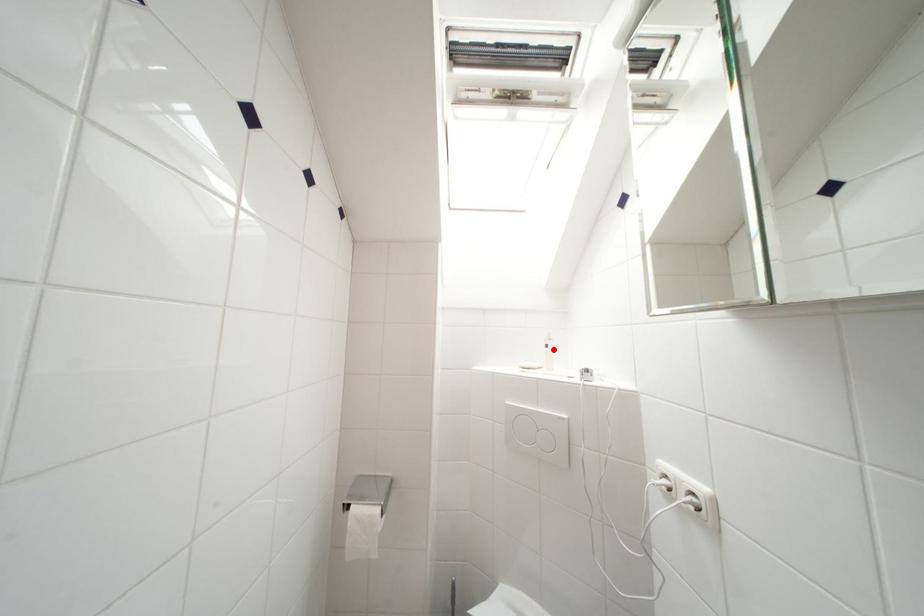
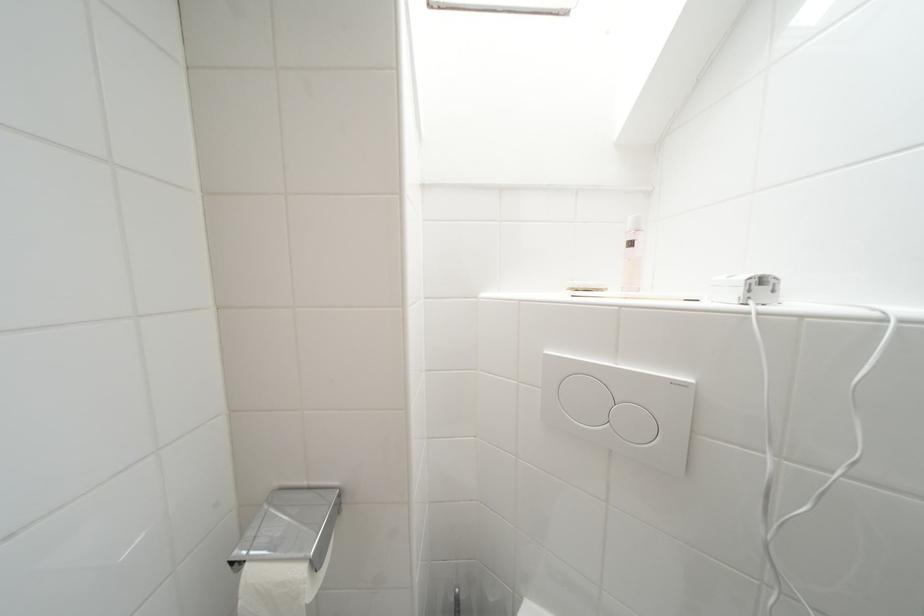
In the second image, find the point that corresponds to the highlighted location in the first image.

(638, 246)